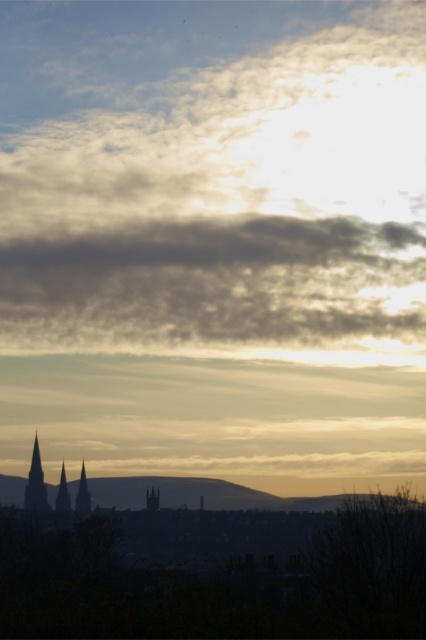
Does smooth stone spire at center have a greater width compared to silvery metallic spire at lower left?

Correct, the width of smooth stone spire at center exceeds that of silvery metallic spire at lower left.

Is smooth stone spire at center to the right of silvery metallic spire at lower left from the viewer's perspective?

Indeed, smooth stone spire at center is positioned on the right side of silvery metallic spire at lower left.

Between point (77, 492) and point (65, 506), which one is positioned in front?

Point (77, 492) is in front.

Find the location of a particular element. This screenshot has width=426, height=640. smooth stone spire at center is located at coordinates (83, 496).

Which is more to the right, dark gray stone tower at lower left or silvery metallic spire at lower left?

silvery metallic spire at lower left is more to the right.

How much distance is there between dark gray stone tower at lower left and silvery metallic spire at lower left?

A distance of 8.98 meters exists between dark gray stone tower at lower left and silvery metallic spire at lower left.

Which is behind, point (42, 500) or point (63, 513)?

Point (63, 513)

I want to click on dark gray stone tower at lower left, so click(36, 483).

Does smooth stone spire at center appear over dark gray stone spire at lower left?

Yes, smooth stone spire at center is above dark gray stone spire at lower left.

Between smooth stone spire at center and dark gray stone spire at lower left, which one is positioned lower?

dark gray stone spire at lower left is below.

You are a GUI agent. You are given a task and a screenshot of the screen. Output one action in this format:
    pyautogui.click(x=<x>, y=<y>)
    Task: Click on the smooth stone spire at center
    This screenshot has height=640, width=426.
    Given the screenshot: What is the action you would take?
    pyautogui.click(x=83, y=496)

Image resolution: width=426 pixels, height=640 pixels. Find the location of `smooth stone spire at center`. smooth stone spire at center is located at coordinates (83, 496).